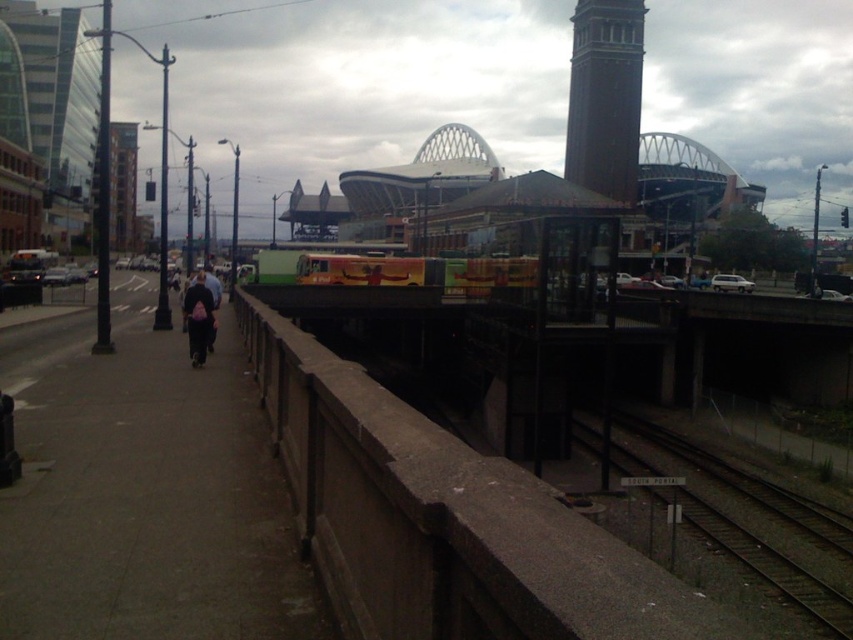
You are a photographer standing on the sidewalk and want to take a photo of the brown brick bell tower at upper center and the dark blue jeans at center. Since you want both subjects in the frame, can you fit them both vertically in the photo?

The brown brick bell tower at upper center is much taller than the dark blue jeans at center, so it might be challenging to fit both vertically in the same frame due to the significant height difference between the two subjects.